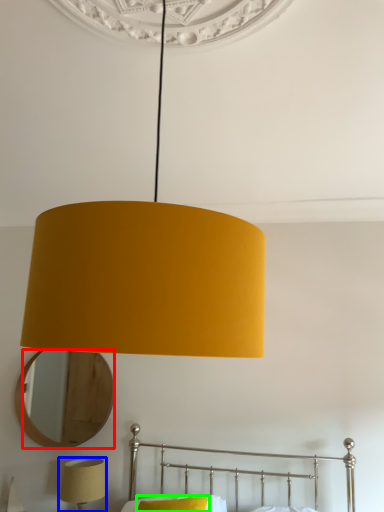
Question: Estimate the real-world distances between objects in this image. Which object is closer to mirror (highlighted by a red box), lamp (highlighted by a blue box) or pillow (highlighted by a green box)?

Choices:
 (A) lamp
 (B) pillow

Answer: (A)